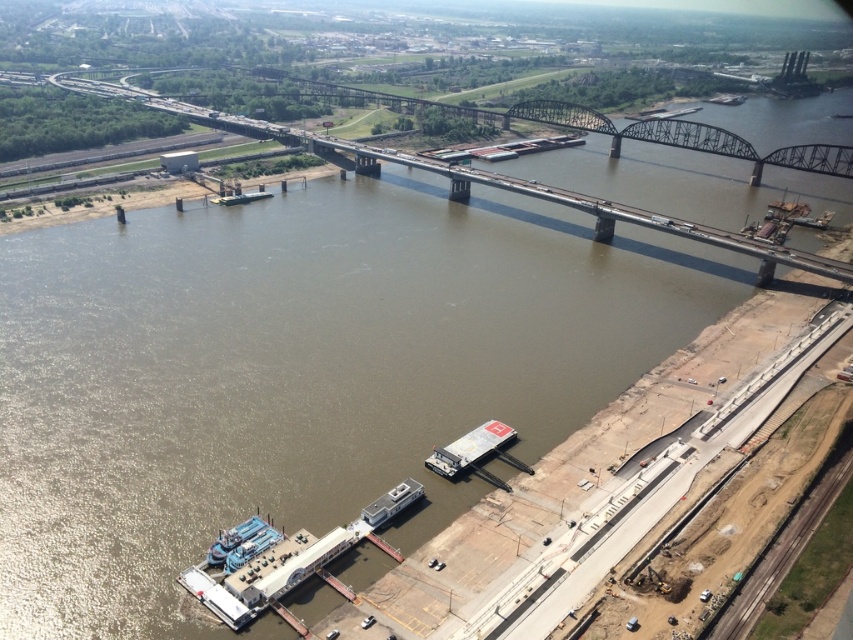
You are a boat operator navigating the white matte barge at center. You need to pass under the metallic gray bridge at center. Can you safely pass under the bridge without any collision?

The metallic gray bridge at center is located above the white matte barge at center, so yes, the barge can safely pass under the bridge as there is sufficient clearance between them.

You are a delivery drone with a maximum flight range of 300 meters. You need to deliver a package from the metallic gray bridge at center to the white matte barge at center. Can you complete the delivery without needing to recharge?

The metallic gray bridge at center and white matte barge at center are 294.81 meters apart. Since the distance is within the drone s 300 meter range, the delivery can be completed without recharging.

Consider the image. You are a drone operator who needs to fly a drone under the metallic gray bridge at center to capture a photo of the white matte barge at center. Can the drone safely pass under the bridge without hitting it?

The metallic gray bridge at center is much taller than the white matte barge at center, so the drone can safely pass under the bridge without hitting it.